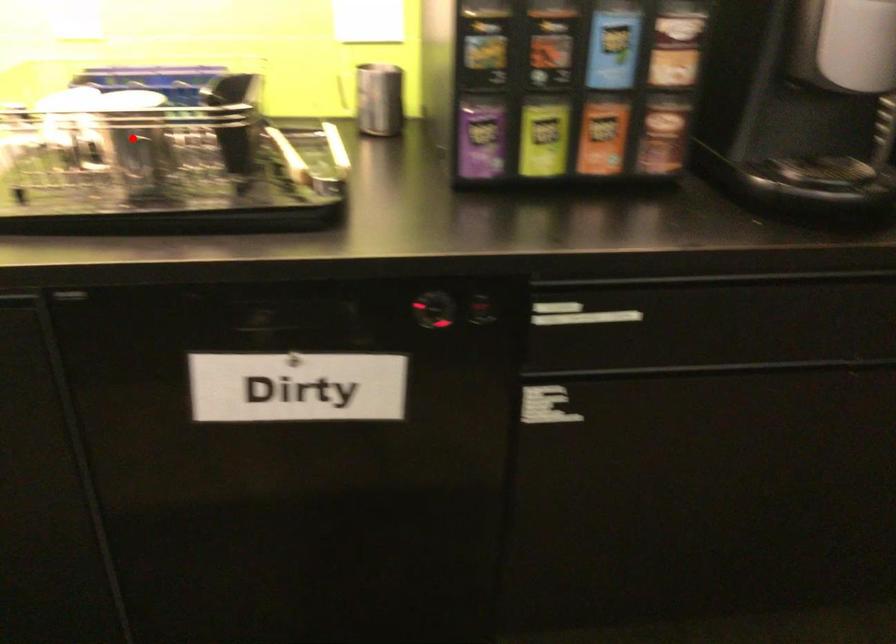
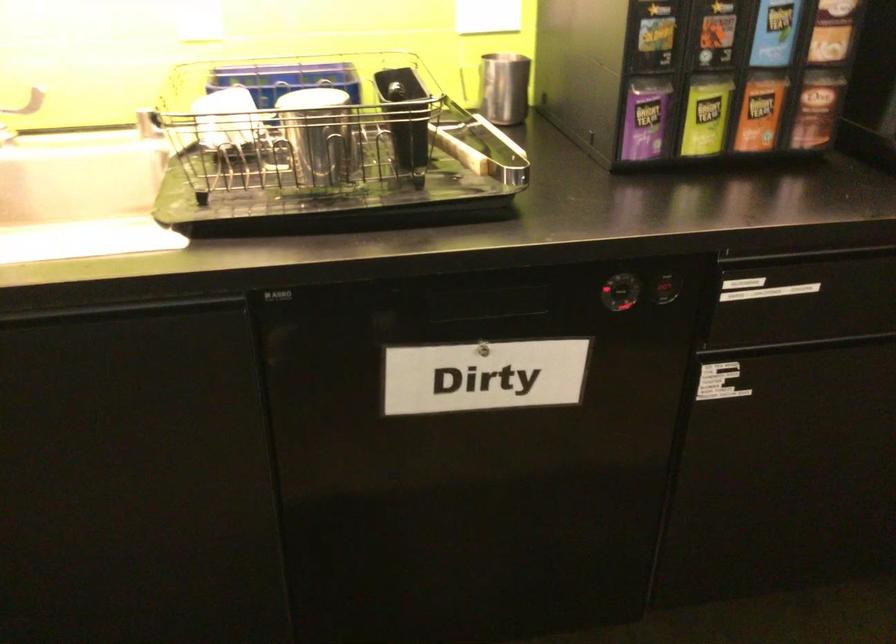
The point at the highlighted location is marked in the first image. Where is the corresponding point in the second image?

(319, 134)